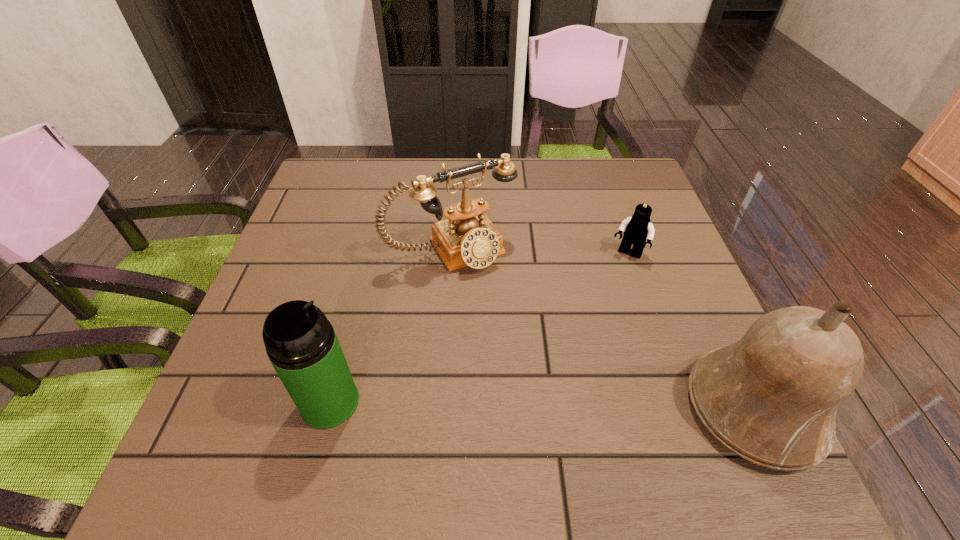
You are a GUI agent. You are given a task and a screenshot of the screen. Output one action in this format:
    pyautogui.click(x=<x>, y=<y>)
    Task: Click on the free space on the desktop that is between the thermos bottle and the bell and is positioned on the front-facing side of the shortest object
    The image size is (960, 540).
    Given the screenshot: What is the action you would take?
    coord(559,406)

The height and width of the screenshot is (540, 960). I want to click on vacant spot on the desktop that is between the thermos bottle and the bell and is positioned on the dial number of the second shortest object, so click(x=554, y=406).